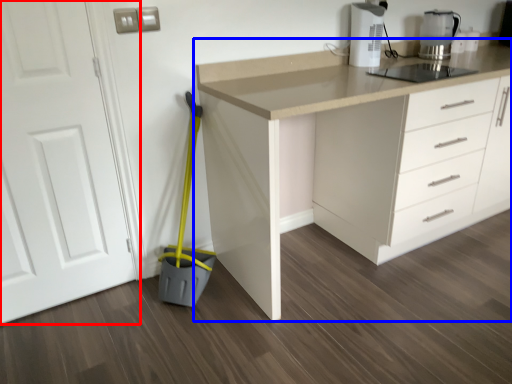
Question: Which point is further to the camera, door (highlighted by a red box) or countertop (highlighted by a blue box)?

Choices:
 (A) door
 (B) countertop

Answer: (B)